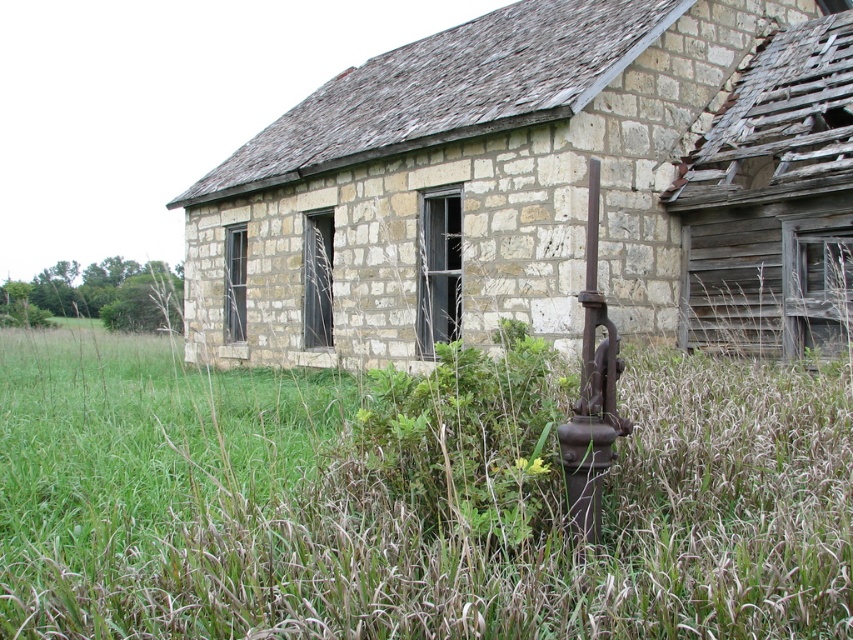
Question: Does green grass at lower left have a larger size compared to stone wall at center?

Choices:
 (A) yes
 (B) no

Answer: (B)

Question: Which of the following is the farthest from the observer?

Choices:
 (A) (453, 573)
 (B) (570, 138)

Answer: (B)

Question: From the image, what is the correct spatial relationship of green grass at lower left in relation to stone wall at center?

Choices:
 (A) left
 (B) right

Answer: (A)

Question: Can you confirm if green grass at lower left is positioned above stone wall at center?

Choices:
 (A) yes
 (B) no

Answer: (B)